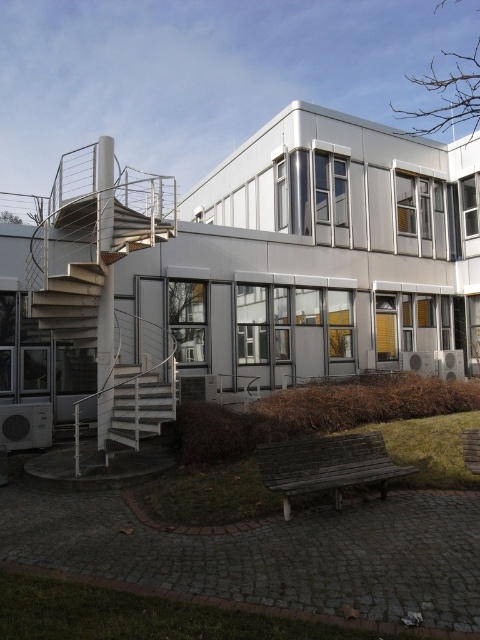
What do you see at coordinates (103, 301) in the screenshot? Image resolution: width=480 pixels, height=640 pixels. I see `white metallic staircase at left` at bounding box center [103, 301].

Does white metallic staircase at left appear under white metallic staircase at lower left?

Incorrect, white metallic staircase at left is not positioned below white metallic staircase at lower left.

Is point (109, 324) positioned before point (151, 371)?

Yes, point (109, 324) is closer to viewer.

Locate an element on the screen. This screenshot has height=640, width=480. white metallic staircase at left is located at coordinates (103, 301).